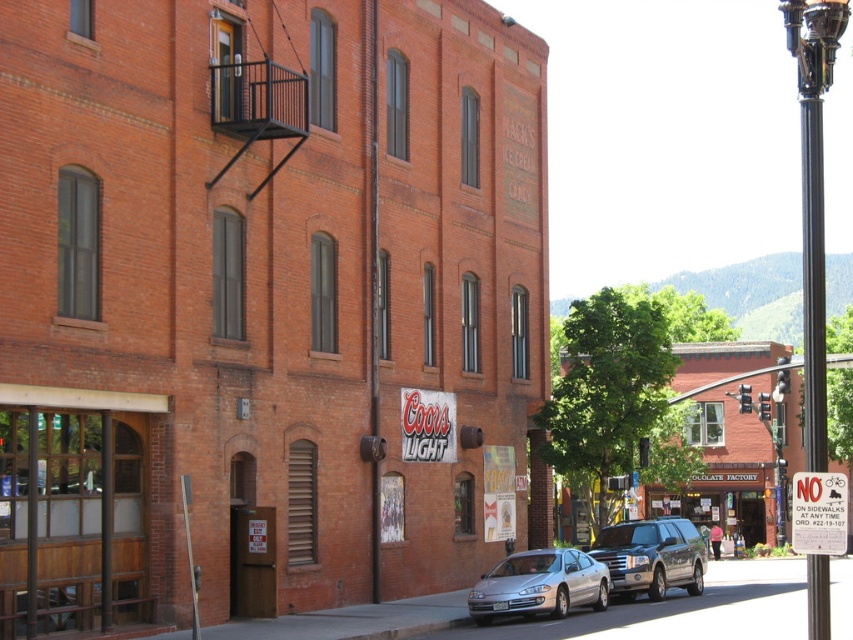
You are a delivery person trying to park your bike between the two poles. Can you fit your bike between the black metal pole at upper right and the black polished metal pole at right?

The black metal pole at upper right is above the black polished metal pole at right, so there is vertical space between them but not horizontal. Therefore, you cannot fit your bike between the black metal pole at upper right and the black polished metal pole at right as they are aligned vertically.